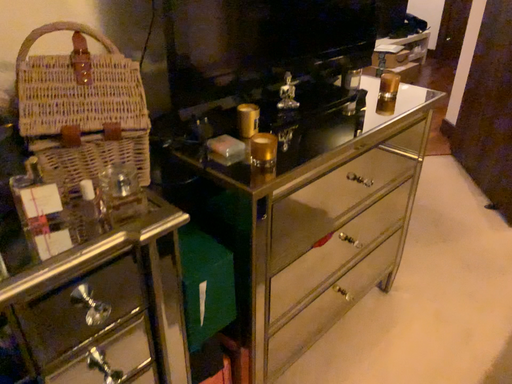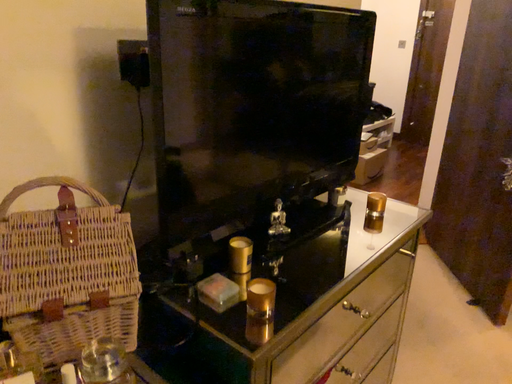
Question: How did the camera likely rotate when shooting the video?

Choices:
 (A) rotated upward
 (B) rotated downward

Answer: (A)